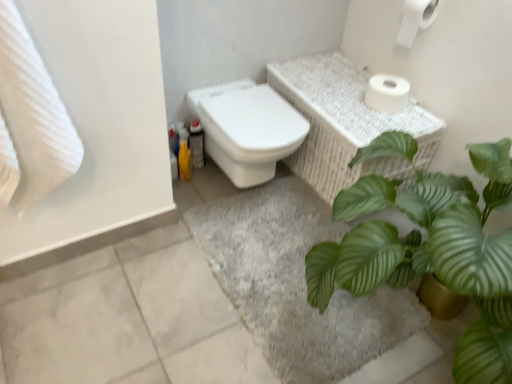
This screenshot has height=384, width=512. I want to click on free space on the front side of white matte toilet paper at upper right, which is counted as the 1th toilet paper, starting from the bottom, so click(x=387, y=122).